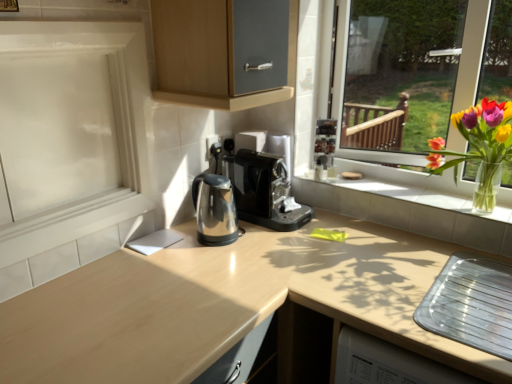
Locate an element on the screen. This screenshot has height=384, width=512. vacant area on top of white tile window sill at center (from a real-world perspective) is located at coordinates (403, 194).